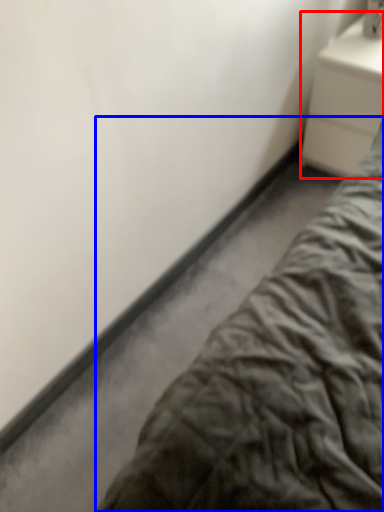
Question: Among these objects, which one is farthest to the camera, nightstand (highlighted by a red box) or bed (highlighted by a blue box)?

Choices:
 (A) nightstand
 (B) bed

Answer: (A)